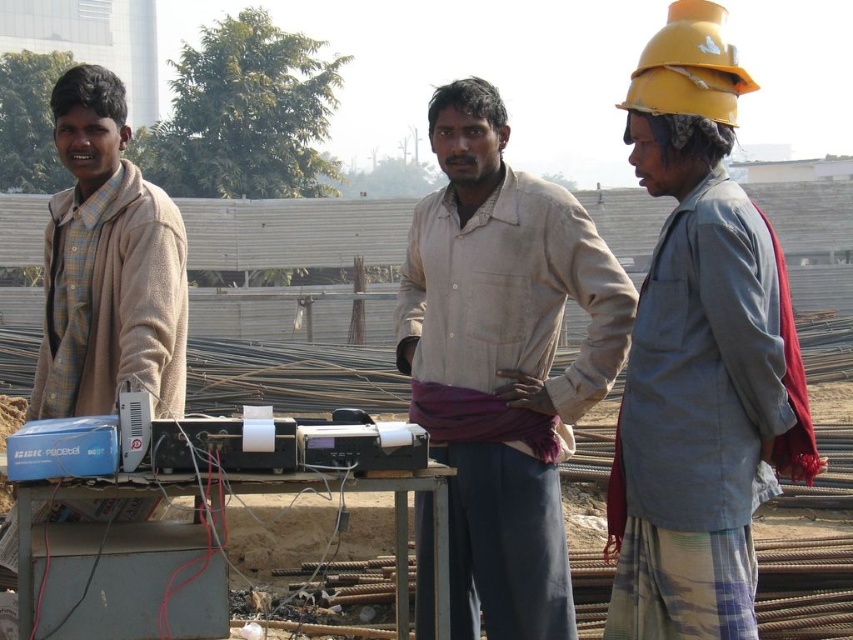
Question: Among these objects, which one is farthest from the camera?

Choices:
 (A) checkered fabric shirt at left
 (B) gray fabric shirt at right
 (C) light brown fabric shirt at center

Answer: (C)

Question: Which of the following is the closest to the observer?

Choices:
 (A) (637, 118)
 (B) (712, 60)

Answer: (B)

Question: Is light brown fabric shirt at center positioned at the back of checkered fabric shirt at left?

Choices:
 (A) yes
 (B) no

Answer: (A)

Question: Is the position of light brown fabric shirt at center less distant than that of yellow matte hard hat at upper right?

Choices:
 (A) no
 (B) yes

Answer: (A)

Question: Among these points, which one is farthest from the camera?

Choices:
 (A) (686, 88)
 (B) (695, 230)

Answer: (A)

Question: Can you confirm if light brown fabric shirt at center is positioned below yellow matte hard hat at upper right?

Choices:
 (A) no
 (B) yes

Answer: (B)